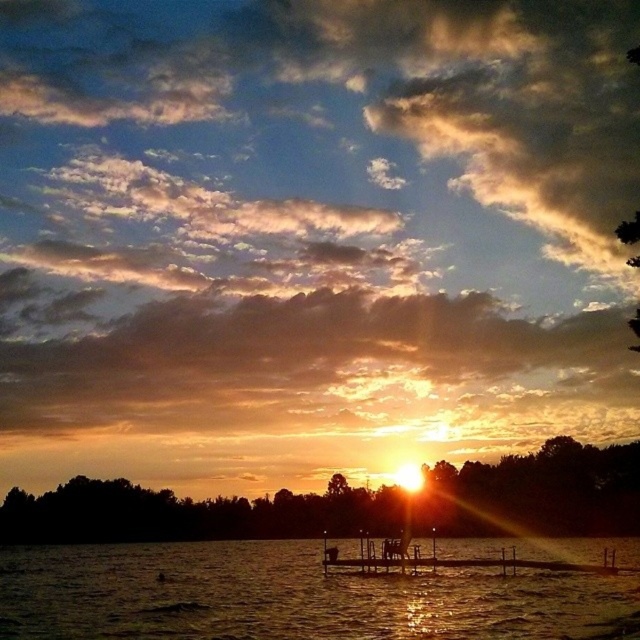
In the scene shown: You are a photographer capturing the sunset scene. You want to ensure both the shiny metallic water at lower center and the brown wooden dock at center are clearly visible in your shot. Given their sizes, which object might require more careful framing to avoid being overwhelmed by the other?

The brown wooden dock at center is smaller than the shiny metallic water at lower center, so it might require more careful framing to avoid being overwhelmed by the larger water area.

You are a photographer trying to capture the sunset. You have a camera with a 24mm lens that can capture a width of 1.2 meters. You see the shiny metallic water at lower center and the brown wooden dock at center. Can both objects fit in your camera frame at the same time?

The shiny metallic water at lower center is wider than the brown wooden dock at center. Since the camera can capture a width of 1.2 meters, both objects can fit in the frame together as long as their combined width does not exceed 1.2 meters. However, the exact feasibility depends on their individual widths and spacing between them, which are not specified here.